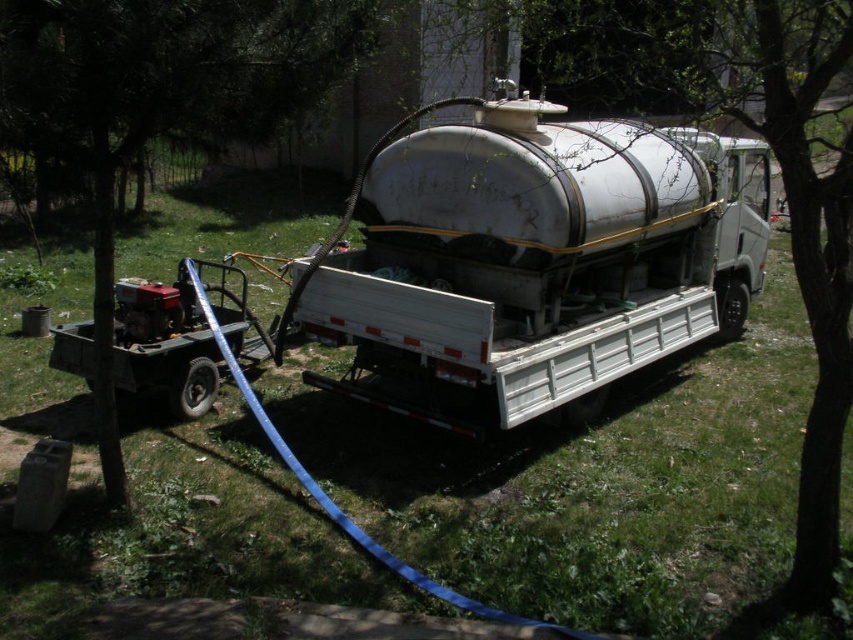
Question: Which of the following is the farthest from the observer?

Choices:
 (A) white matte tanker truck at center
 (B) green leafy tree at upper left

Answer: (A)

Question: Among these points, which one is nearest to the camera?

Choices:
 (A) pyautogui.click(x=610, y=179)
 (B) pyautogui.click(x=804, y=468)

Answer: (B)

Question: Can you confirm if green grass at center is smaller than green leafy tree at upper right?

Choices:
 (A) yes
 (B) no

Answer: (A)

Question: Is green grass at center positioned before green leafy tree at upper left?

Choices:
 (A) yes
 (B) no

Answer: (B)

Question: Does white matte tanker truck at center have a greater width compared to green leafy tree at upper right?

Choices:
 (A) yes
 (B) no

Answer: (A)

Question: Which object appears closest to the camera in this image?

Choices:
 (A) green grass at center
 (B) white matte tanker truck at center
 (C) green leafy tree at upper right
 (D) green leafy tree at upper left

Answer: (C)